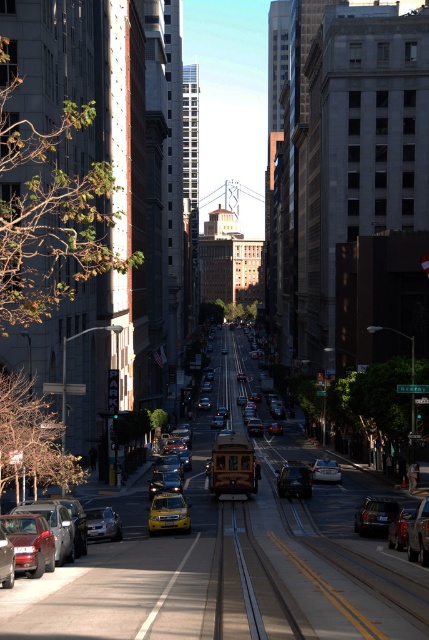
Who is more forward, (x=75, y=540) or (x=296, y=483)?

Positioned in front is point (x=75, y=540).

Between matte red car at lower left and shiny silver sedan at center, which one has less height?

shiny silver sedan at center is shorter.

Does point (42, 508) lie behind point (299, 476)?

No, it is in front of (299, 476).

You are a GUI agent. You are given a task and a screenshot of the screen. Output one action in this format:
    pyautogui.click(x=<x>, y=<y>)
    Task: Click on the matte red car at lower left
    
    Given the screenshot: What is the action you would take?
    53,518

Does point (407, 516) lie in front of point (313, 467)?

That is True.

From the picture: Can you confirm if metallic silver car at lower right is positioned below matte silver sedan at center?

No.

The image size is (429, 640). What do you see at coordinates (399, 529) in the screenshot?
I see `metallic silver car at lower right` at bounding box center [399, 529].

Find the location of a particular element. metallic silver car at lower right is located at coordinates (399, 529).

Who is lower down, yellow matte taxi at lower center or shiny silver sedan at lower left?

yellow matte taxi at lower center is below.

Can you confirm if yellow matte taxi at lower center is smaller than shiny silver sedan at lower left?

No, yellow matte taxi at lower center is not smaller than shiny silver sedan at lower left.

The width and height of the screenshot is (429, 640). What do you see at coordinates (169, 513) in the screenshot?
I see `yellow matte taxi at lower center` at bounding box center [169, 513].

Where is `yellow matte taxi at lower center`? Image resolution: width=429 pixels, height=640 pixels. yellow matte taxi at lower center is located at coordinates (169, 513).